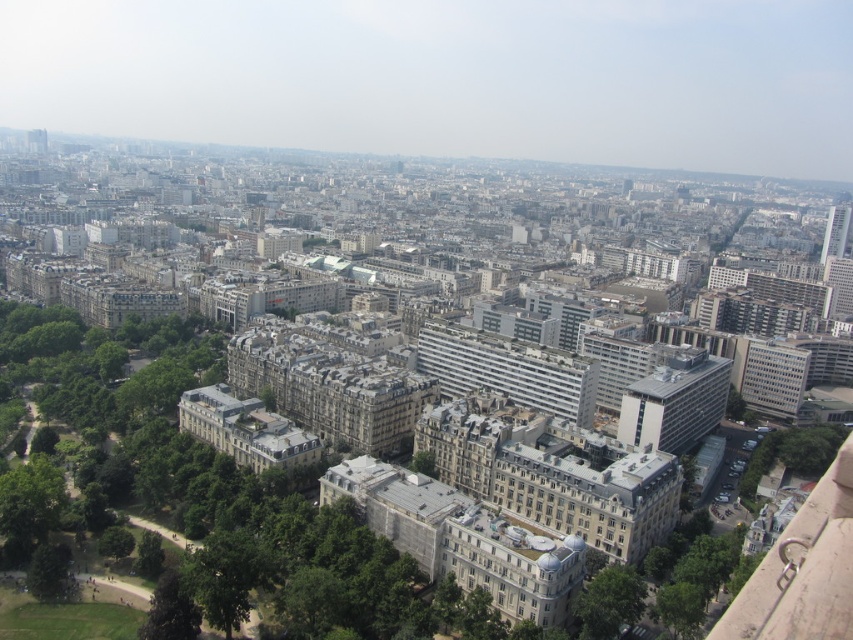
You are a city planner analyzing the urban layout. You observe the green leafy tree at lower right and the green leafy tree at lower left in the aerial view. Which tree has a greater width?

The green leafy tree at lower right has a greater width than the green leafy tree at lower left.

You are a city planner analyzing this aerial view. You notice two green leafy trees in the park area. Which one is taller? The options are the green leafy tree at lower right and the green leafy tree at lower left.

The green leafy tree at lower right is taller than the green leafy tree at lower left according to the description.